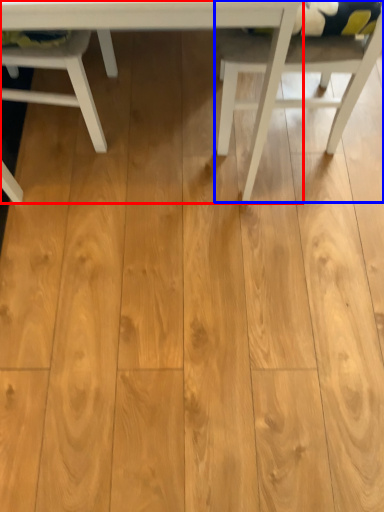
Question: Which point is closer to the camera, table (highlighted by a red box) or chair (highlighted by a blue box)?

Choices:
 (A) table
 (B) chair

Answer: (A)